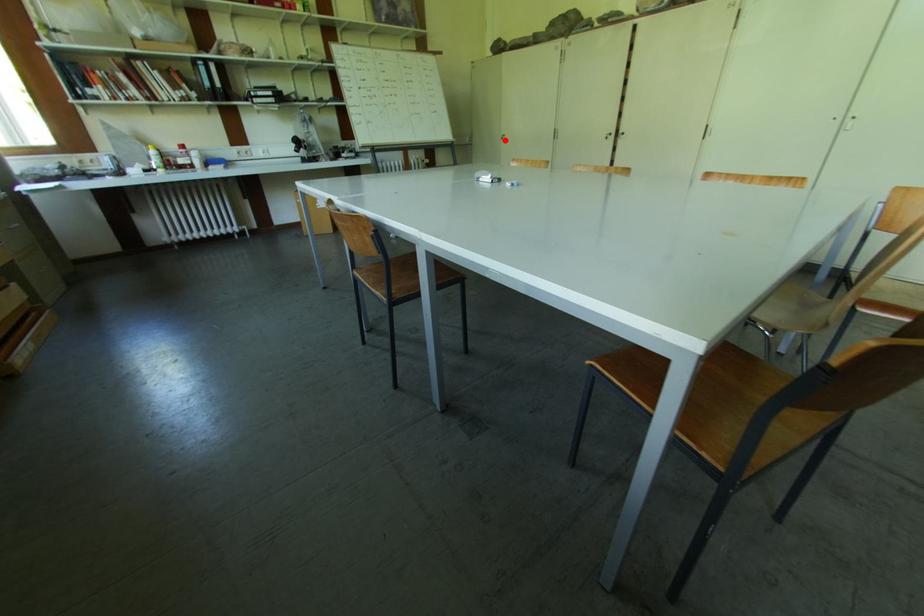
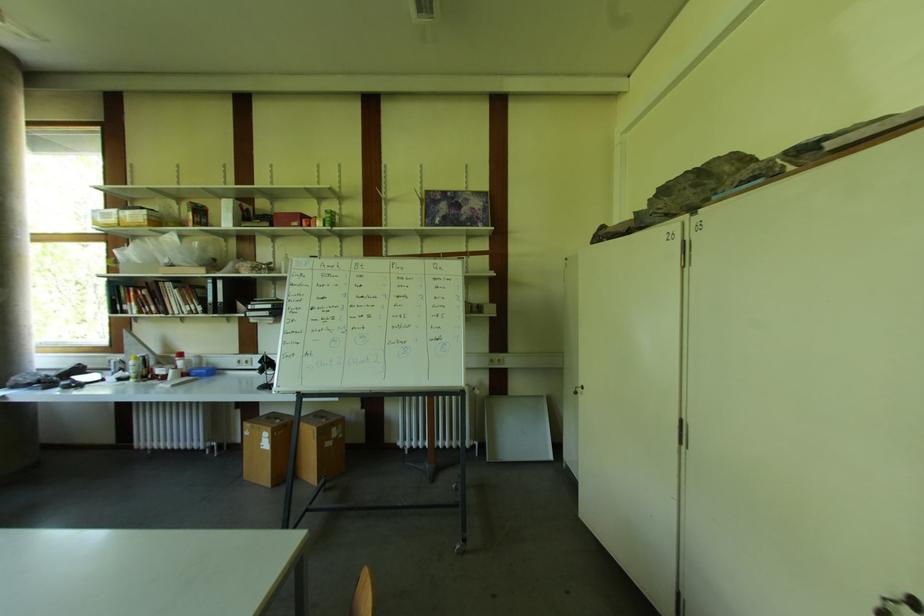
Question: I am providing you with two images of the same scene from different viewpoints. In image1, a red point is highlighted. Considering the same 3D point in image2, which of the following is correct?

Choices:
 (A) It is closer
 (B) It is farther

Answer: (B)